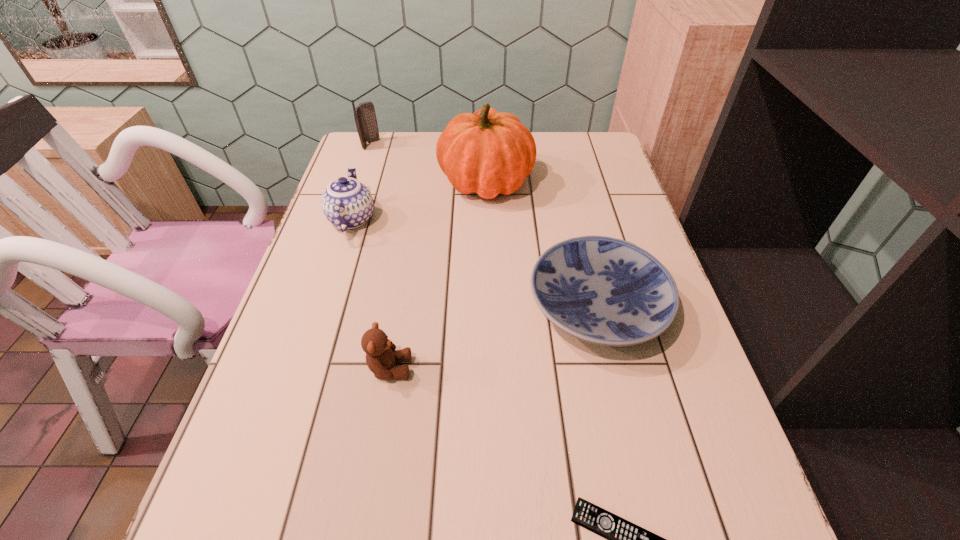
The image size is (960, 540). In order to click on vacant position located at the spout of the chinaware in this screenshot , I will do `click(370, 165)`.

Where is `vacant region located at the spout of the chinaware`? The width and height of the screenshot is (960, 540). vacant region located at the spout of the chinaware is located at coordinates (366, 176).

Where is `free space located 0.120m on the face of the third object from left to right`? This screenshot has height=540, width=960. free space located 0.120m on the face of the third object from left to right is located at coordinates (472, 368).

Identify the location of vacant space located 0.400m on the back of the second shortest object. (564, 170).

I want to click on pumpkin that is at the far edge, so click(x=489, y=153).

This screenshot has width=960, height=540. In order to click on cellular telephone that is at the far edge in this screenshot , I will do `click(365, 117)`.

This screenshot has width=960, height=540. What are the coordinates of `cellular telephone located in the left edge section of the desktop` in the screenshot? It's located at (365, 117).

The height and width of the screenshot is (540, 960). I want to click on chinaware present at the left edge, so click(x=347, y=203).

I want to click on object that is at the right edge, so click(602, 290).

Find the location of a particular element. The height and width of the screenshot is (540, 960). object that is at the far left corner is located at coordinates (365, 117).